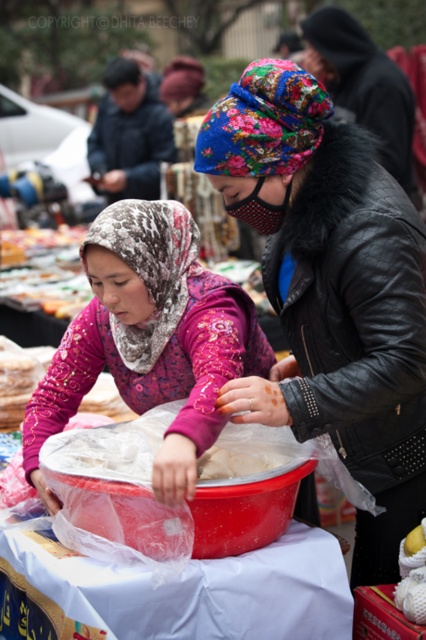
You are a customer at the market and see both the white matte apple at center and the white fluffy dough at center. Which item is bigger?

The white matte apple at center is larger in size compared to the white fluffy dough at center.

You are a customer at the market and want to buy the white matte apple at center. The vendor is wearing a dark blue fabric headscarf at upper left. Which object is higher in the image?

The dark blue fabric headscarf at upper left is much taller than the white matte apple at center in the image.

You are a customer at the market and want to approach the woman on the left to buy something. Which point, point (227,378) or point (402,589), is closer to you as you walk towards her?

Point (227,378) is closer to you because it is further to the viewer than point (402,589).